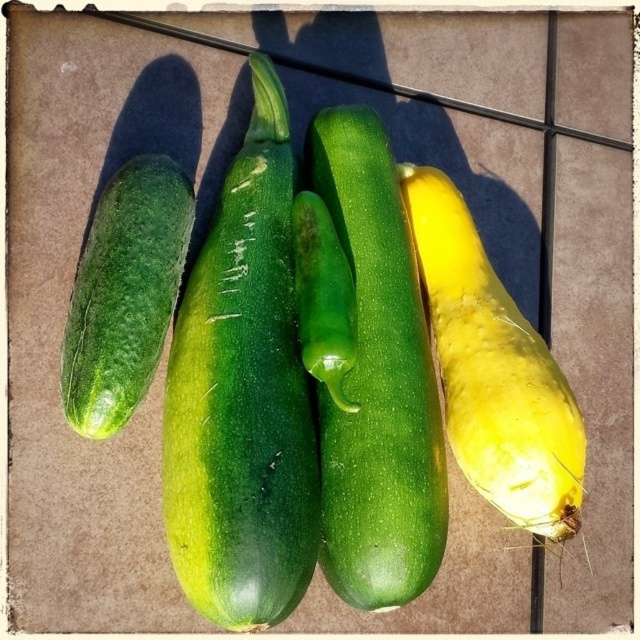
You are a chef preparing a platter and need to arrange the green matte cucumber at center and the green glossy pepper at center. If you want to place them exactly 5 inches apart, will you need to move them closer together or farther apart?

The current distance between the green matte cucumber at center and the green glossy pepper at center is 4.56 inches. To reach 5 inches, you need to move them farther apart.

You are arranging vegetables on a counter and see the green smooth cucumber at center and the yellow matte squash at right. Which vegetable is located to the right of the other?

The yellow matte squash at right is located to the right of the green smooth cucumber at center.

You are arranging vegetables on a tiled counter. You have a yellow matte squash at right and a green matte cucumber at left. If you want to place a cutting board between them, where should you position it?

The yellow matte squash at right is located below the green matte cucumber at left, so you should place the cutting board between the yellow matte squash at right and the green matte cucumber at left horizontally, ensuring it is between their positions.